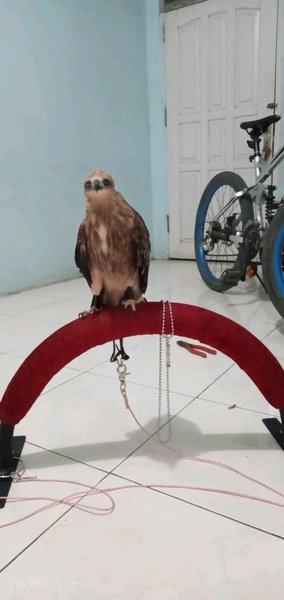
The height and width of the screenshot is (600, 284). I want to click on flooring, so click(x=79, y=443), click(x=105, y=537), click(x=57, y=546), click(x=24, y=534), click(x=162, y=476), click(x=213, y=424), click(x=233, y=378), click(x=190, y=372), click(x=274, y=344), click(x=14, y=338).